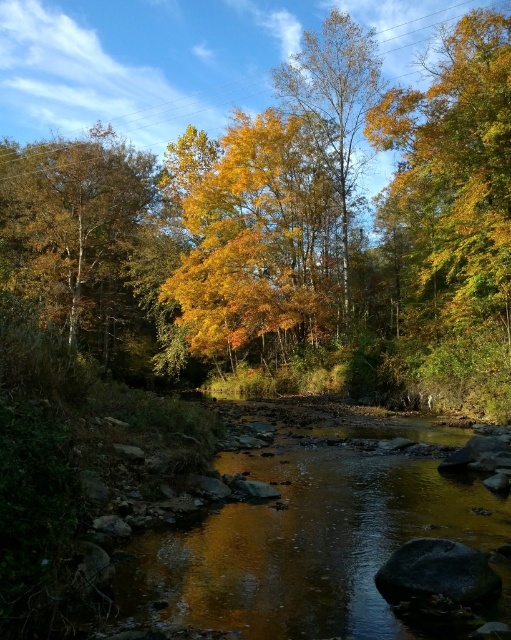
You are standing at the edge of the stream and see two points marked in the image. The first point is at coordinates point (197, 268) and the second is at point (301, 296). Which point is closer to you?

Point (197, 268) is further to the camera than point (301, 296), so the point closer to you is point (301, 296).

You are a photographer planning to capture the autumn scenery. You have a camera with a wide angle lens that can capture large areas. You want to focus on the shiny brown water at center and the golden textured leaves at left. Which object should you prioritize to ensure it fits entirely in the frame?

You should prioritize capturing the golden textured leaves at left first because the shiny brown water at center is smaller than golden textured leaves at left, so it will be easier to fit the larger object in the frame.